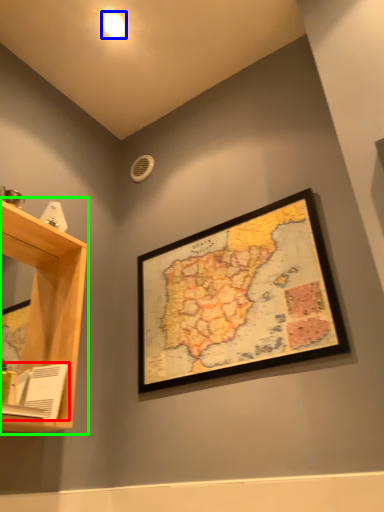
Question: Estimate the real-world distances between objects in this image. Which object is farther from book (highlighted by a red box), light (highlighted by a blue box) or shelf (highlighted by a green box)?

Choices:
 (A) light
 (B) shelf

Answer: (A)